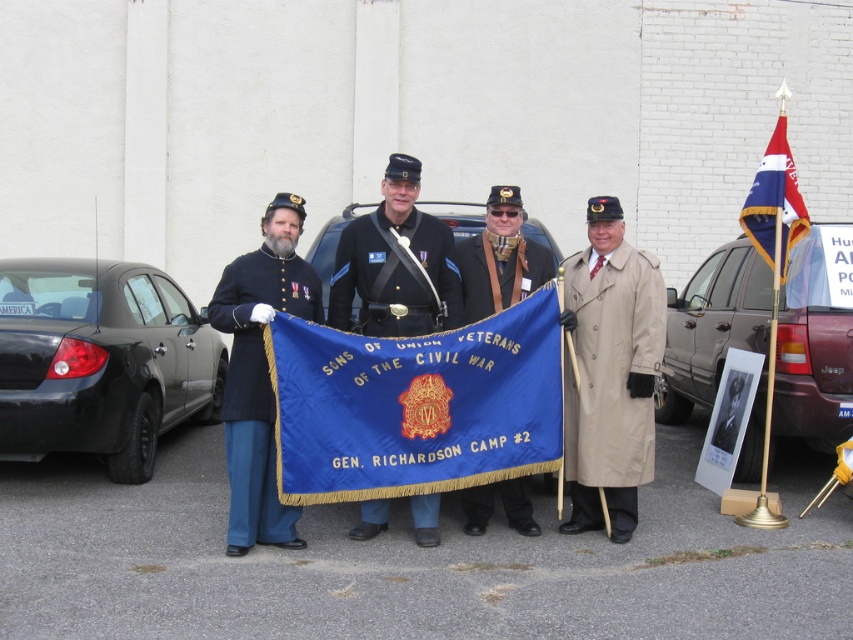
Question: Which object is closer to the camera taking this photo?

Choices:
 (A) black matte sedan at left
 (B) blue fabric flag at center
 (C) matte black coat at left

Answer: (C)

Question: Does matte black coat at left appear on the left side of blue fabric flag at upper right?

Choices:
 (A) no
 (B) yes

Answer: (B)

Question: Can you confirm if black matte sedan at left is positioned above maroon metallic suv at right?

Choices:
 (A) no
 (B) yes

Answer: (B)

Question: Which point appears closest to the camera in this image?

Choices:
 (A) (602, 381)
 (B) (482, 285)
 (C) (834, 426)
 (D) (558, 445)

Answer: (D)

Question: Does blue cotton flag at center have a smaller size compared to black leather uniform at center?

Choices:
 (A) yes
 (B) no

Answer: (B)

Question: Estimate the real-world distances between objects in this image. Which object is closer to the black matte sedan at left?

Choices:
 (A) blue velvet flag at center
 (B) blue fabric flag at upper right

Answer: (A)